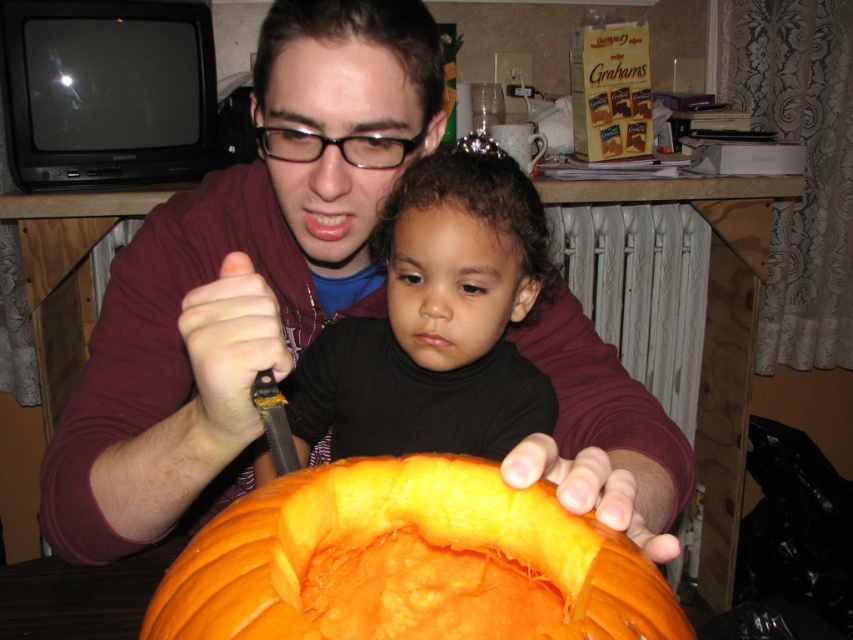
Based on the photo, you are a photographer taking a picture of the orange smooth pumpkin at center and the black matte baby at center. To ensure both subjects are in frame, should you adjust your camera to the left or the right?

The orange smooth pumpkin at center is to the left of the black matte baby at center, so you should adjust your camera to the right to include both subjects in the frame.

You are a delivery robot with a 4.5 inches wide package. You need to place the package between the matte maroon hoodie at center and the black matte baby at center. Can you fit the package in the space between them?

The space between the matte maroon hoodie at center and the black matte baby at center is 4.60 inches. Since the package is 4.5 inches wide, it can fit in the space between them as it is slightly narrower than the available space.